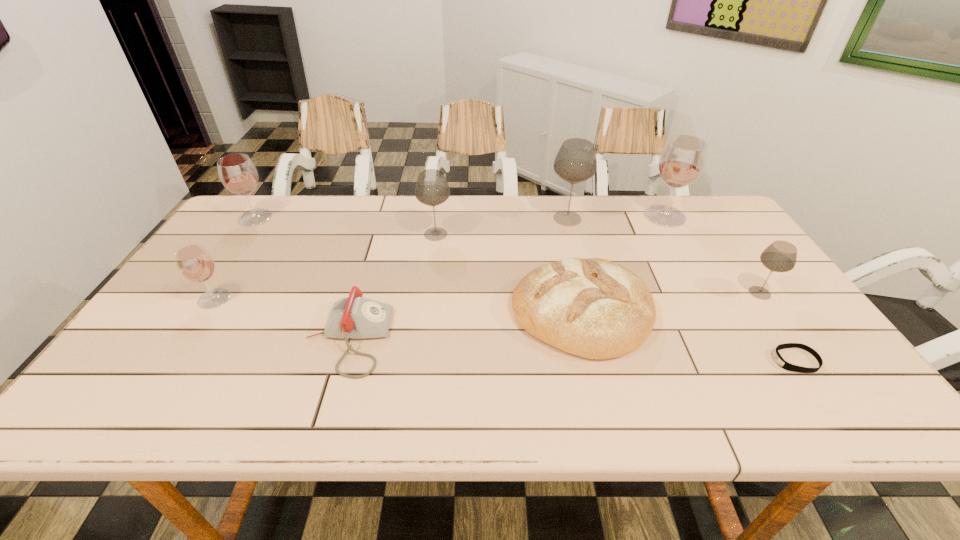
Locate an element on the screen. This screenshot has width=960, height=540. the second closest gray wineglass to the wristband is located at coordinates (575, 162).

The image size is (960, 540). I want to click on vacant position in the image that satisfies the following two spatial constraints: 1. on the back side of the nearest red wineglass; 2. on the left side of the fourth wineglass from right to left, so click(256, 234).